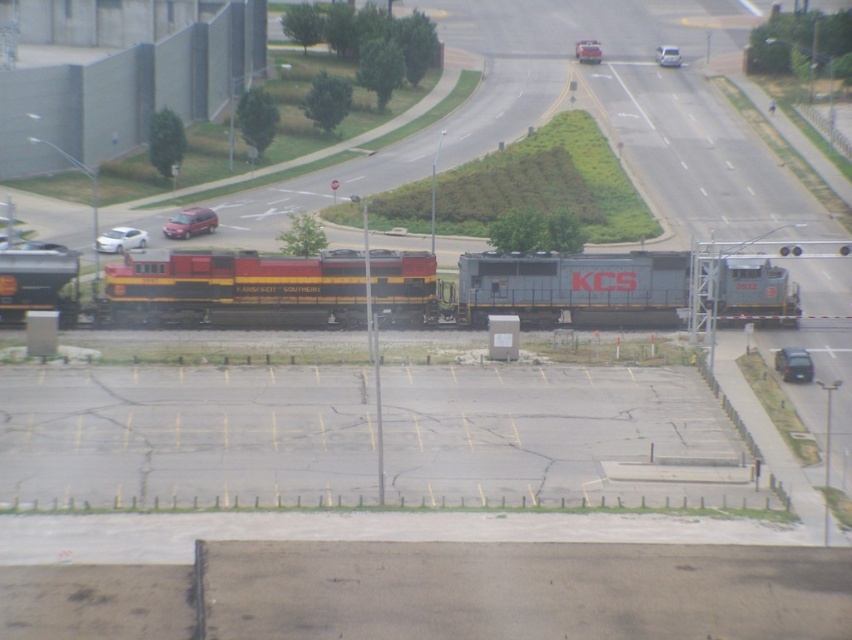
Question: Considering the real-world distances, which object is closest to the metallic gray train at center?

Choices:
 (A) white glossy sedan at left
 (B) matte red suv at left
 (C) metallic silver sedan at center

Answer: (A)

Question: Which point is closer to the camera?

Choices:
 (A) (131, 232)
 (B) (584, 61)
 (C) (786, 349)

Answer: (C)

Question: Is metallic gray train at center in front of white glossy sedan at lower left?

Choices:
 (A) no
 (B) yes

Answer: (B)

Question: Which object is farther from the camera taking this photo?

Choices:
 (A) metallic gray sedan at center
 (B) matte red suv at left
 (C) metallic silver sedan at center

Answer: (C)

Question: Is the position of metallic gray train at center more distant than that of metallic silver sedan at center?

Choices:
 (A) yes
 (B) no

Answer: (B)

Question: Does metallic gray train at center appear on the right side of white glossy sedan at center?

Choices:
 (A) yes
 (B) no

Answer: (B)